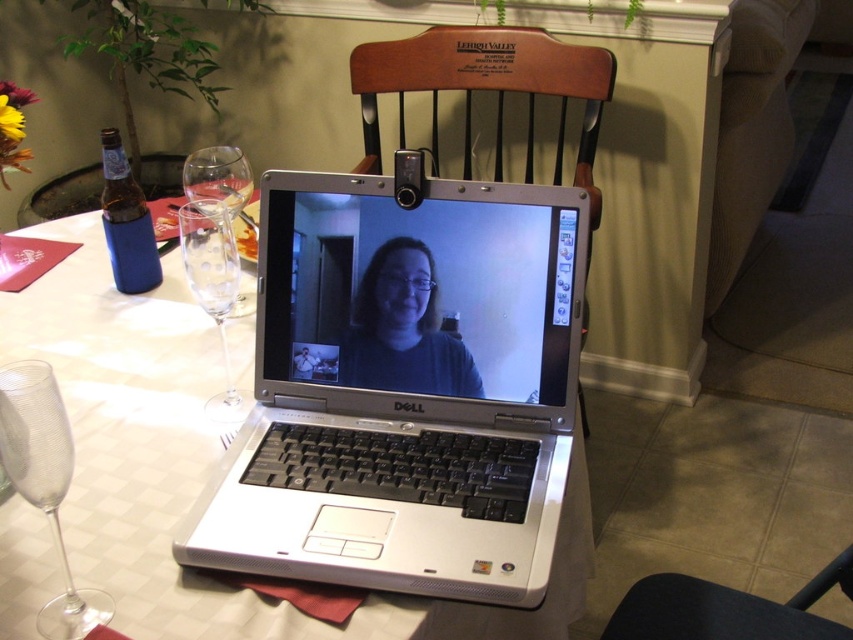
You are a guest at a dinner party and notice the matte black shirt at center and the clear textured glass at lower left on the table. Which object is closer to you from your seated position?

The clear textured glass at lower left is closer to you because it is below the matte black shirt at center, which is positioned above it.

You are a guest at a dinner party and want to sit down. There is a wooden chair at center and a transparent glass at left. Which object should you avoid sitting on to prevent breaking it?

You should avoid sitting on the transparent glass at left because it is fragile and not designed for sitting. The wooden chair at center is meant for sitting.

Consider the image. You are a photographer trying to capture a closeup shot of the matte black shirt at center. Your camera has a minimum focusing distance of 35 inches. Can you take the photo without moving the shirt or the camera?

The matte black shirt at center is 36.75 inches away from camera, which is beyond the camera minimum focusing distance of 35 inches. Therefore, you can take the photo without moving the shirt or the camera.